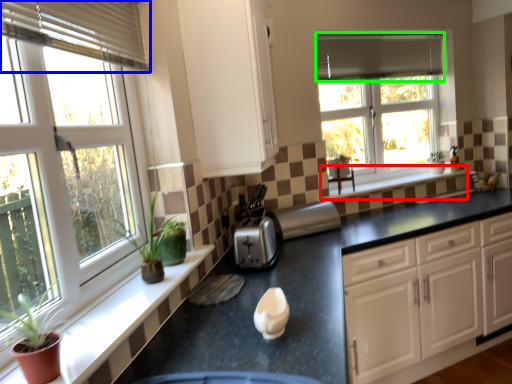
Question: Considering the real-world distances, which object is farthest from window sill (highlighted by a red box)? blind (highlighted by a blue box) or blind (highlighted by a green box)?

Choices:
 (A) blind
 (B) blind

Answer: (A)